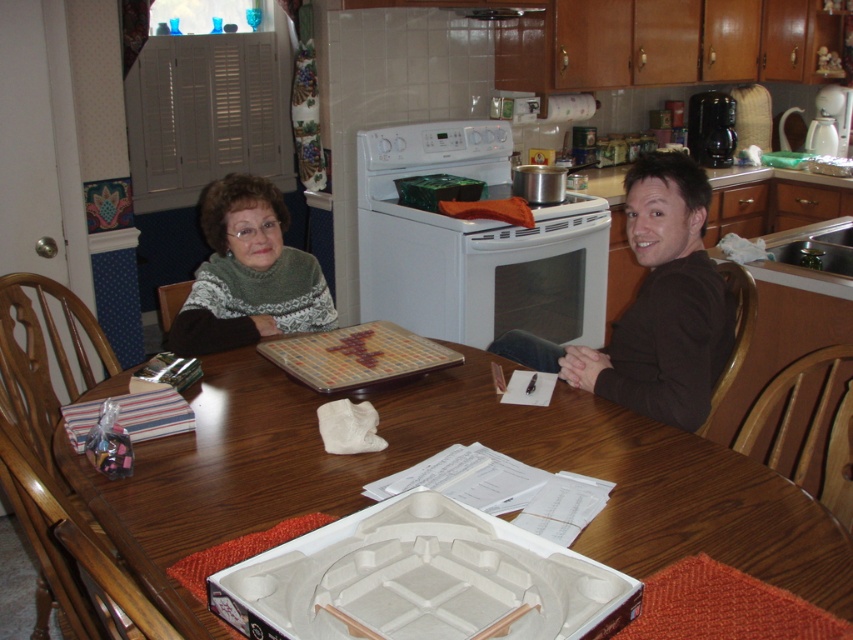
Question: Does wooden table at center appear on the right side of white glossy stove at center?

Choices:
 (A) yes
 (B) no

Answer: (B)

Question: From the image, what is the correct spatial relationship of wooden table at center in relation to green knitted sweater at upper left?

Choices:
 (A) left
 (B) right

Answer: (B)

Question: Which of the following is the closest to the observer?

Choices:
 (A) (239, 236)
 (B) (547, 218)
 (C) (612, 541)

Answer: (C)

Question: Which of these objects is positioned farthest from the wooden table at center?

Choices:
 (A) white glossy stove at center
 (B) green knitted sweater at upper left

Answer: (A)

Question: Which point appears farthest from the camera in this image?

Choices:
 (A) (213, 496)
 (B) (329, 317)
 (C) (374, 168)

Answer: (C)

Question: Where is white glossy stove at center located in relation to green knitted sweater at upper left in the image?

Choices:
 (A) left
 (B) right

Answer: (B)